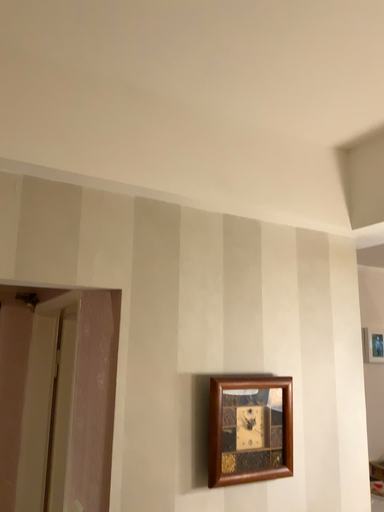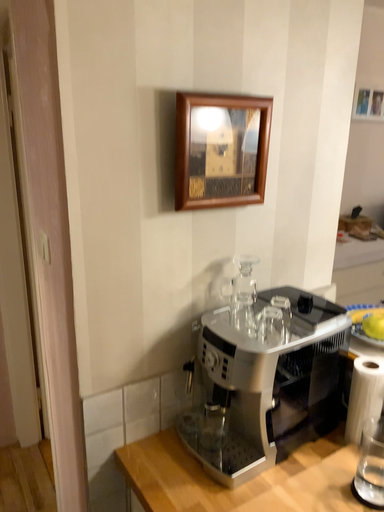
Question: Which way did the camera rotate in the video?

Choices:
 (A) rotated upward
 (B) rotated downward

Answer: (B)